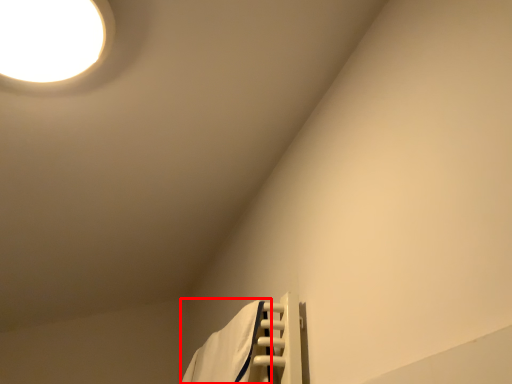
Question: From the image's perspective, where is bath towel (annotated by the red box) located in relation to lamp in the image?

Choices:
 (A) below
 (B) above

Answer: (A)